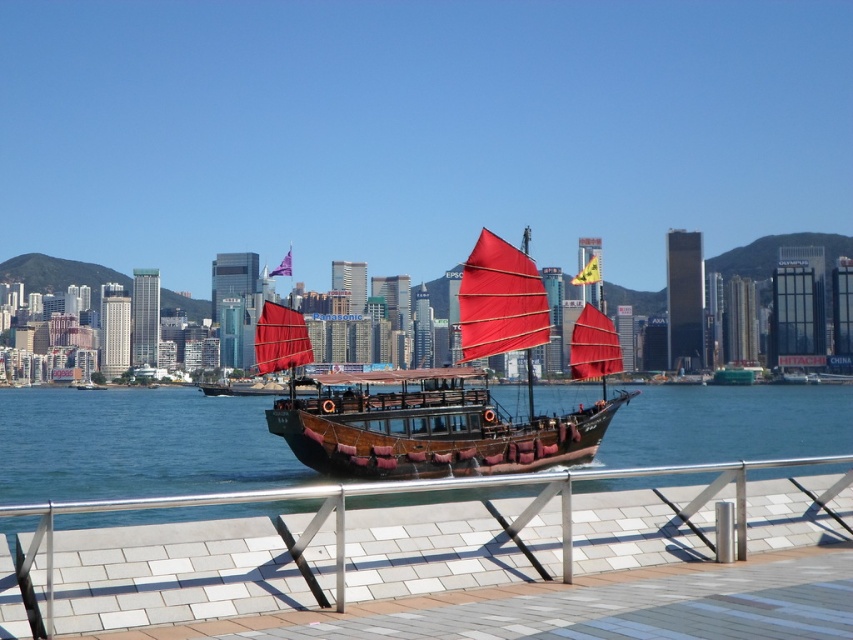
Who is more distant from viewer, (9, 605) or (82, 472)?

Point (82, 472)

Based on the photo, who is higher up, white tile dock at lower center or transparent blue water at center?

white tile dock at lower center

The height and width of the screenshot is (640, 853). Find the location of `white tile dock at lower center`. white tile dock at lower center is located at coordinates (395, 541).

Which is in front, point (210, 538) or point (482, 250)?

Positioned in front is point (210, 538).

Can you confirm if white tile dock at lower center is bigger than wooden boat at center?

Actually, white tile dock at lower center might be smaller than wooden boat at center.

Between point (490, 502) and point (476, 328), which one is positioned behind?

Positioned behind is point (476, 328).

I want to click on white tile dock at lower center, so click(395, 541).

What do you see at coordinates (137, 444) in the screenshot? This screenshot has width=853, height=640. I see `transparent blue water at center` at bounding box center [137, 444].

What are the coordinates of `transparent blue water at center` in the screenshot? It's located at (137, 444).

I want to click on transparent blue water at center, so click(137, 444).